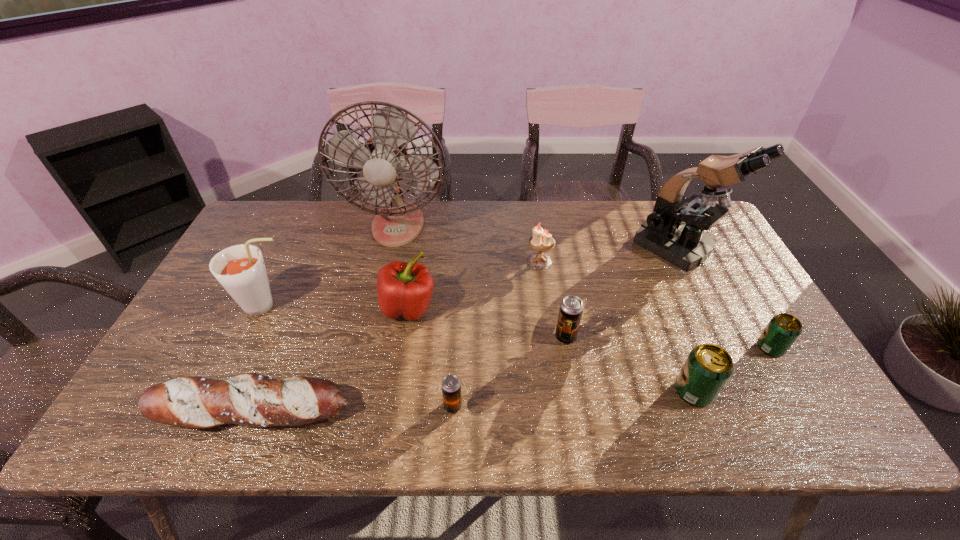
This screenshot has height=540, width=960. In order to click on free space located 0.090m on the front of the right black beer can in this screenshot , I will do `click(572, 376)`.

The height and width of the screenshot is (540, 960). I want to click on free location located 0.090m on the left of the smaller green beer can, so [x=721, y=348].

The width and height of the screenshot is (960, 540). What are the coordinates of `free point located 0.220m on the left of the nearer black beer can` in the screenshot? It's located at (346, 406).

The width and height of the screenshot is (960, 540). I want to click on vacant region located on the right of the baguet, so click(388, 411).

Find the location of a particular element. fan present at the far edge is located at coordinates (x=384, y=156).

The width and height of the screenshot is (960, 540). Find the location of `microscope situated at the far edge`. microscope situated at the far edge is located at coordinates (674, 230).

This screenshot has height=540, width=960. I want to click on baguet present at the near edge, so click(x=250, y=399).

This screenshot has height=540, width=960. What are the coordinates of `root beer located at the left edge` in the screenshot? It's located at (240, 269).

Locate an element on the screen. baguet located in the left edge section of the desktop is located at coordinates (250, 399).

The width and height of the screenshot is (960, 540). I want to click on microscope that is at the right edge, so click(674, 230).